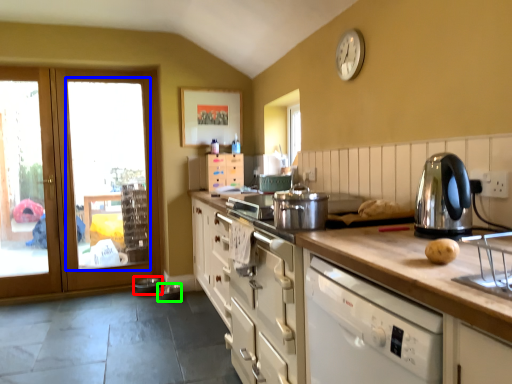
Question: Which object is positioned closest to appliance (highlighted by a red box)? Select from window (highlighted by a blue box) and appliance (highlighted by a green box).

Choices:
 (A) window
 (B) appliance

Answer: (B)